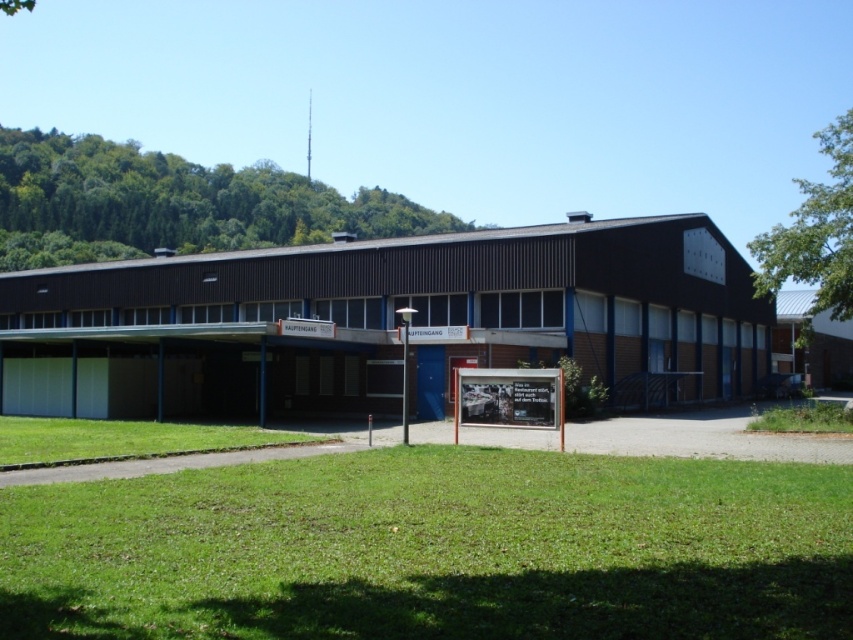
Between point (4, 465) and point (781, 413), which one is positioned behind?

The point (781, 413) is behind.

Does green grass at lower left have a lesser width compared to green grass at lower right?

Yes.

Locate an element on the screen. green grass at lower left is located at coordinates (125, 440).

At what (x,y) coordinates should I click in order to perform the action: click on green grass at lower left. Please return your answer as a coordinate pair (x, y). The image size is (853, 640). Looking at the image, I should click on (125, 440).

Is point (329, 582) positioned behind point (112, 442)?

No, it is not.

In the scene shown: Can you confirm if green grass at lower center is taller than green grass at lower left?

In fact, green grass at lower center may be shorter than green grass at lower left.

Is point (55, 541) closer to viewer compared to point (134, 420)?

Yes, it is in front of point (134, 420).

Where is `green grass at lower center`? The height and width of the screenshot is (640, 853). green grass at lower center is located at coordinates (434, 548).

Between green grass at lower center and green grass at lower right, which one appears on the right side from the viewer's perspective?

green grass at lower right is more to the right.

Is point (352, 620) positioned after point (842, 410)?

No, (352, 620) is closer to viewer.

Where is `green grass at lower center`? The width and height of the screenshot is (853, 640). green grass at lower center is located at coordinates (434, 548).

Locate an element on the screen. green grass at lower center is located at coordinates (434, 548).